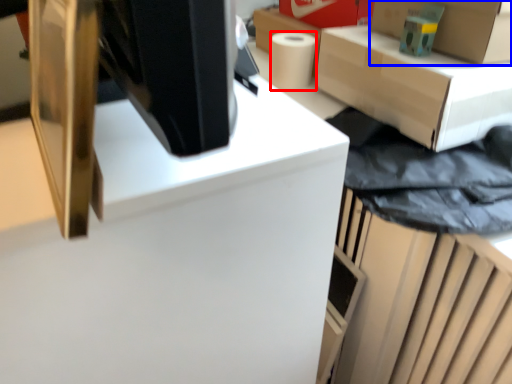
Question: Which point is closer to the camera, paper towel (highlighted by a red box) or box (highlighted by a blue box)?

Choices:
 (A) paper towel
 (B) box

Answer: (B)